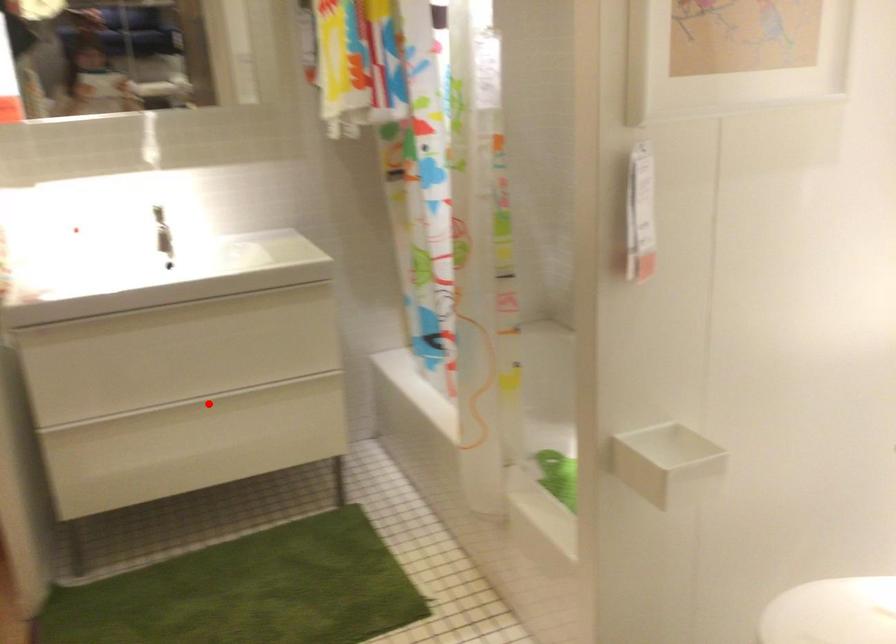
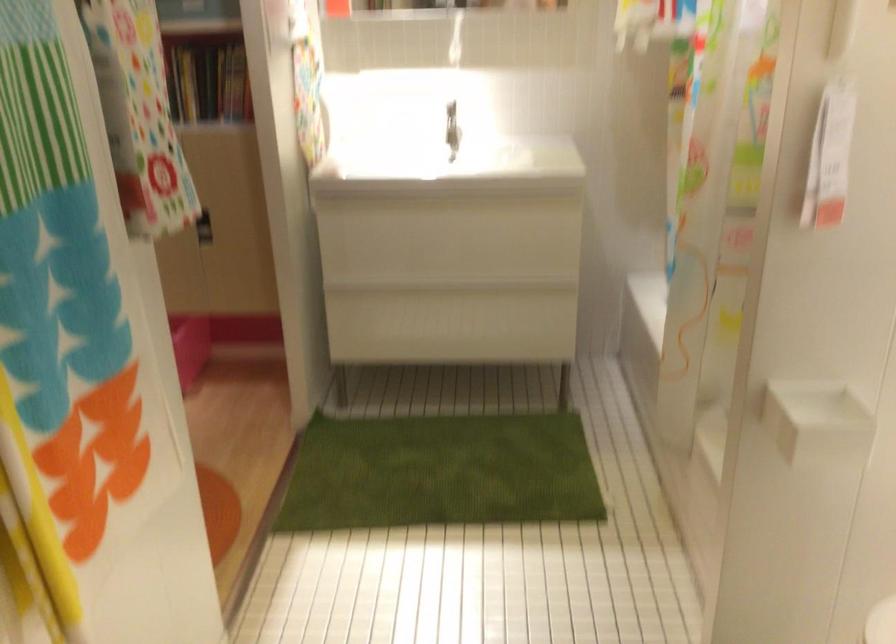
Locate, in the second image, the point that corresponds to the highlighted location in the first image.

(453, 288)